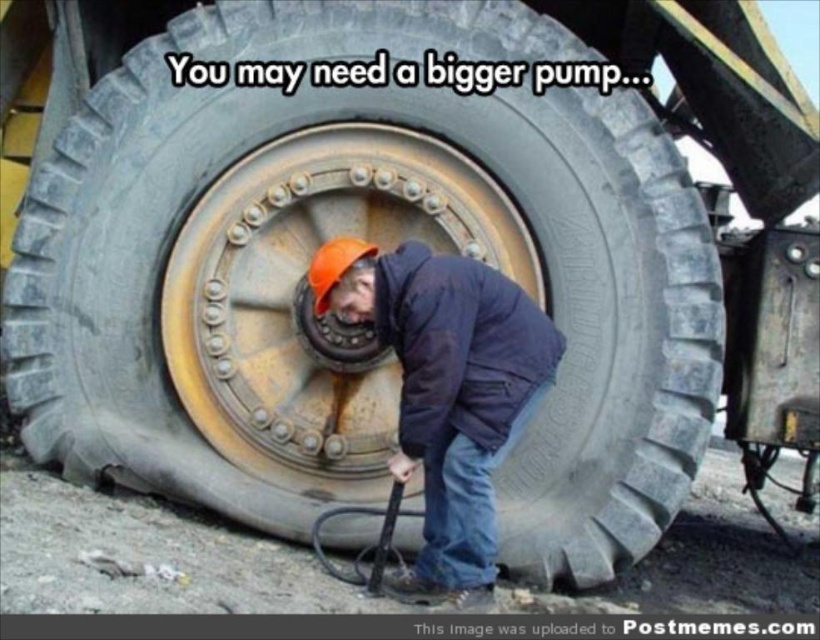
You are a construction worker standing at the camera position. You need to reach the rusty metal rim at center to attach a safety chain. Can you safely reach it without moving your feet?

The rusty metal rim at center is 2.86 meters away from the camera, so you cannot safely reach it without moving your feet since the distance is too great.

Based on the scene description, which object is taller between the rusty metal rim at center and the orange hard hat at center?

The rusty metal rim at center is much taller than the orange hard hat at center.

You are a safety inspector checking the workspace. You notice the rusty metal rim at center and the orange hard hat at center. According to safety regulations, the minimum safe distance between heavy machinery parts and protective equipment should be at least 16 inches to prevent entanglement. Is the current distance compliant?

The rusty metal rim at center and orange hard hat at center are 15.41 inches apart, which is less than the required 16 inches. This violates the safety regulation, so the distance is not compliant.